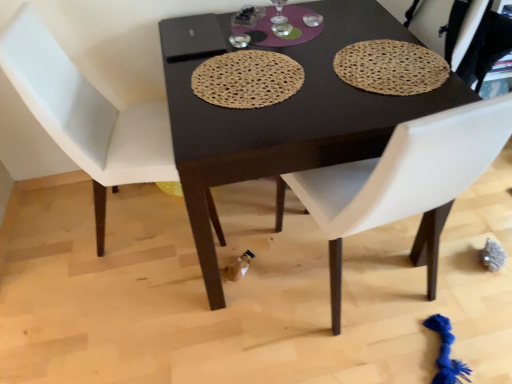
Where is `vacant area that lies between white leather chair at left, arranged as the 1th chair when viewed from the left, and dark brown wood table at center`? The height and width of the screenshot is (384, 512). vacant area that lies between white leather chair at left, arranged as the 1th chair when viewed from the left, and dark brown wood table at center is located at coordinates (159, 273).